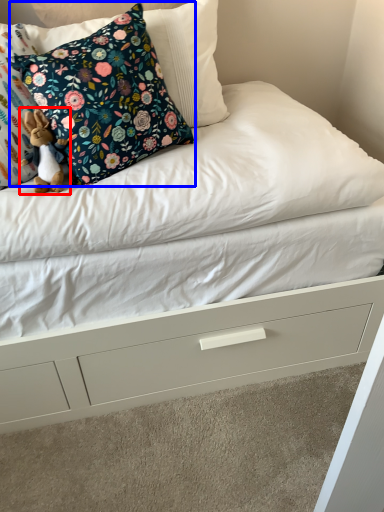
Question: Among these objects, which one is farthest to the camera, toy (highlighted by a red box) or pillow (highlighted by a blue box)?

Choices:
 (A) toy
 (B) pillow

Answer: (A)